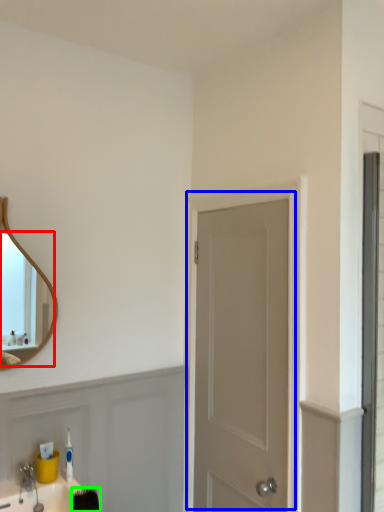
Question: Considering the real-world distances, which object is farthest from mirror (highlighted by a red box)? door (highlighted by a blue box) or brush (highlighted by a green box)?

Choices:
 (A) door
 (B) brush

Answer: (A)